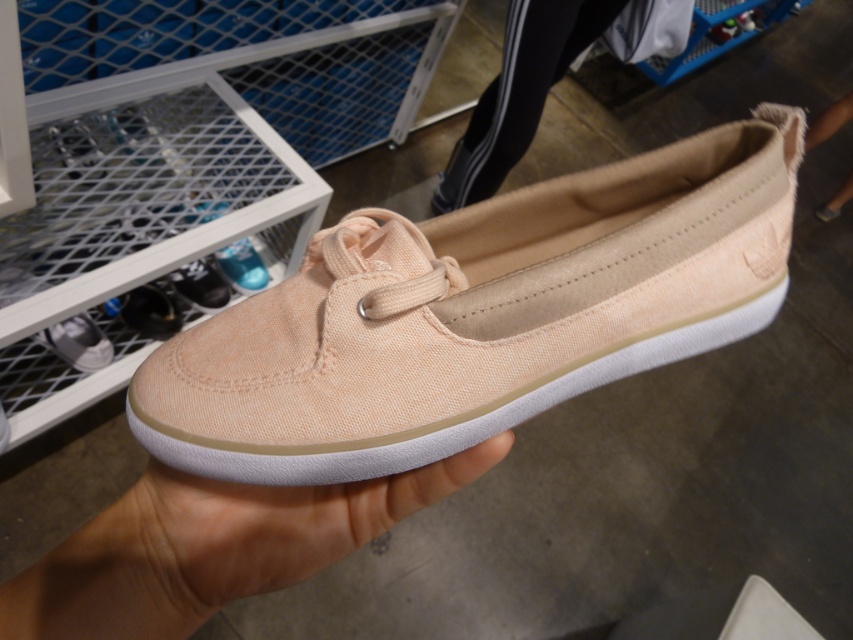
You are a customer in a shoe store looking at the light pink canvas shoe at center. The store requires you to step on a specific point to try on the shoes. The point is marked at coordinate point (x=282, y=522). Can you step on that point while keeping both feet on the floor?

The light pink canvas shoe at center is located at point (x=282, y=522). Since the point is exactly where the shoe is placed, stepping on that point would require placing your foot where the shoe is currently positioned. However, the question mentions keeping both feet on the floor, so you can step on the marked point as long as you can balance or move the shoe aside first.

You are standing in a shoe store and want to pick up the shoe at point (468, 451). If your hand is 16 inches long, can you reach it?

The point (468, 451) is 16.77 inches away from the viewer. Since your hand is 16 inches long, you cannot reach it because the distance is slightly longer than your hand length.